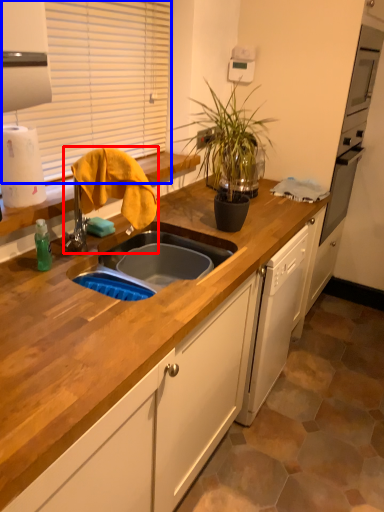
Question: Which of the following is the farthest to the observer, faucet (highlighted by a red box) or window screen (highlighted by a blue box)?

Choices:
 (A) faucet
 (B) window screen

Answer: (B)